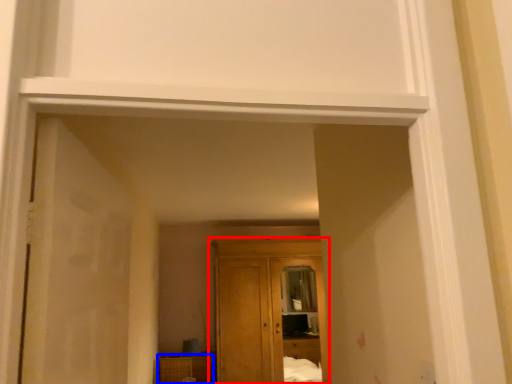
Question: Which object is further to the camera taking this photo, cupboard (highlighted by a red box) or cabinetry (highlighted by a blue box)?

Choices:
 (A) cupboard
 (B) cabinetry

Answer: (B)